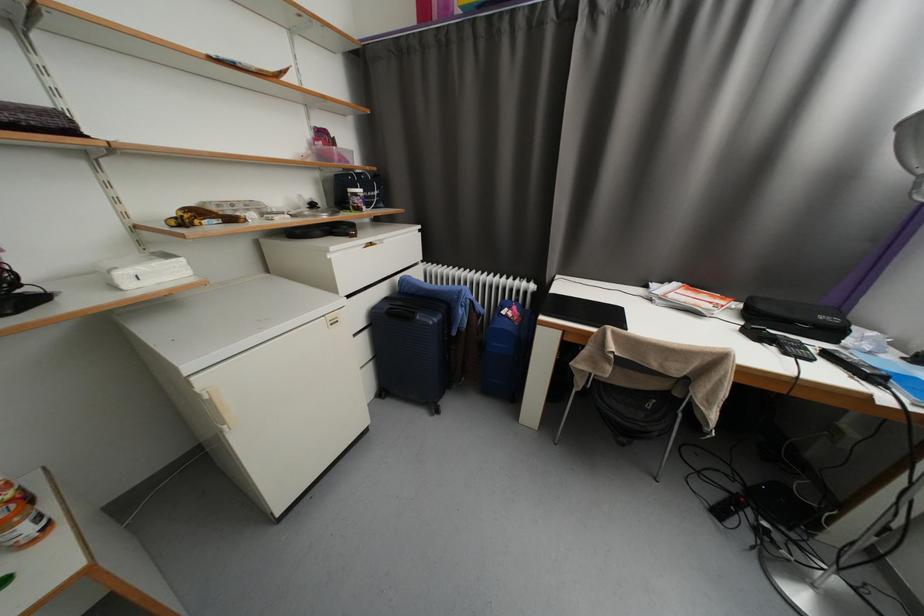
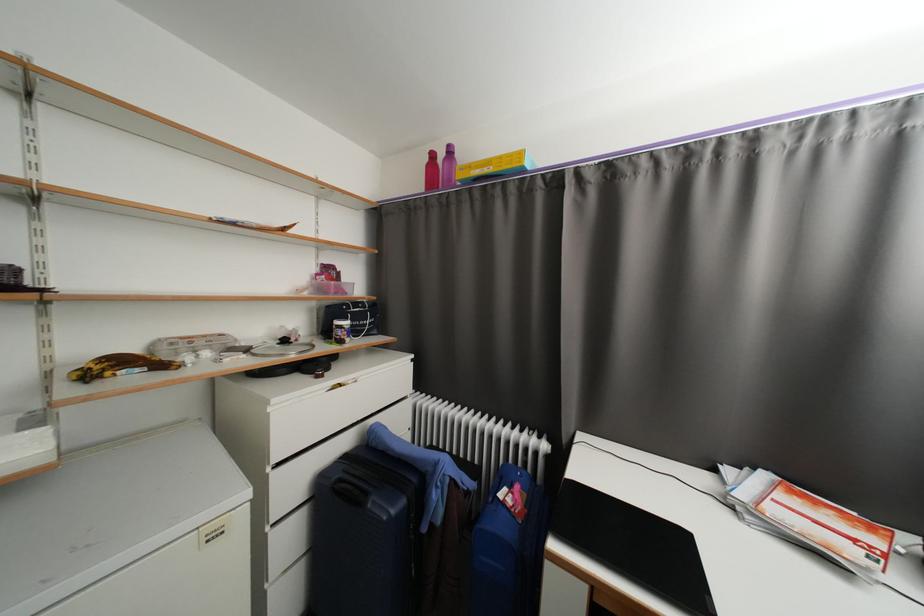
The point at (237, 220) is marked in the first image. Where is the corresponding point in the second image?

(167, 367)